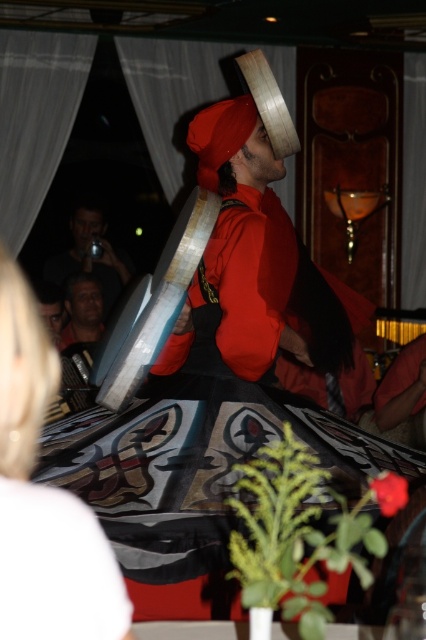
Between matte black camera at upper left and matte black face at center, which one is positioned lower?

Result: matte black face at center

Is matte black camera at upper left thinner than matte black face at center?

No.

The height and width of the screenshot is (640, 426). In order to click on matte black camera at upper left in this screenshot , I will do `click(91, 253)`.

Is point (0, 307) behind point (88, 237)?

No, it is not.

Can you confirm if blonde hair at upper left is positioned below matte black camera at upper left?

Correct, blonde hair at upper left is located below matte black camera at upper left.

Between point (6, 317) and point (129, 259), which one is positioned behind?

The point (129, 259) is more distant.

The image size is (426, 640). In order to click on blonde hair at upper left in this screenshot , I will do `click(45, 497)`.

Can you confirm if blonde hair at upper left is positioned above matte black face at center?

No.

Consider the image. Who is taller, blonde hair at upper left or matte black face at center?

With more height is blonde hair at upper left.

I want to click on blonde hair at upper left, so click(45, 497).

This screenshot has width=426, height=640. What are the coordinates of `blonde hair at upper left` in the screenshot? It's located at (45, 497).